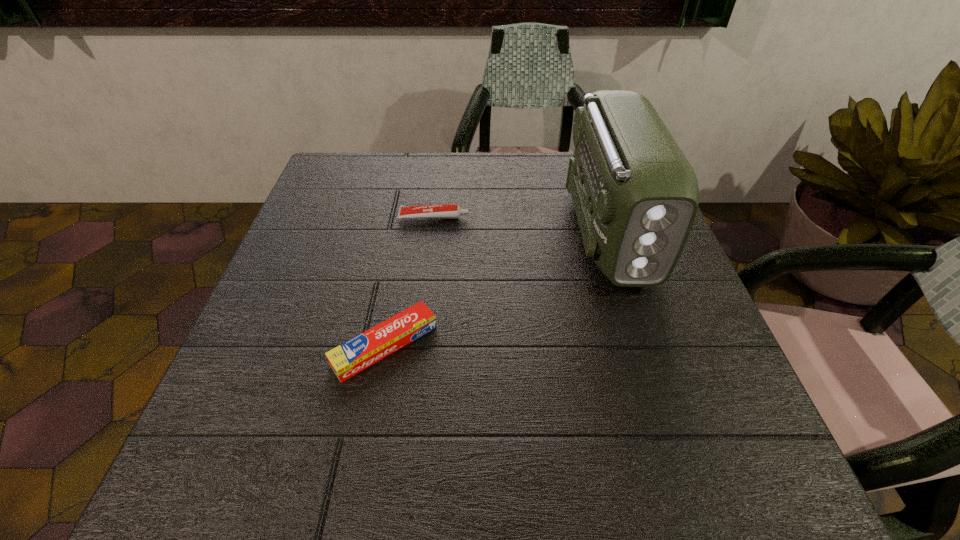
What are the coordinates of `free space between the farther toothpaste and the nearest object` in the screenshot? It's located at 410,281.

The height and width of the screenshot is (540, 960). In order to click on vacant region between the radio_receiver and the farther toothpaste in this screenshot , I will do `click(521, 224)`.

Image resolution: width=960 pixels, height=540 pixels. In order to click on free space between the nearest object and the rightmost object in this screenshot , I will do `click(497, 287)`.

Where is `free point between the radio_receiver and the nearest object`? free point between the radio_receiver and the nearest object is located at coordinates (497, 287).

Image resolution: width=960 pixels, height=540 pixels. I want to click on free area in between the radio_receiver and the farther toothpaste, so click(521, 224).

Identify the location of free point between the farther toothpaste and the radio_receiver. The image size is (960, 540). (521, 224).

At what (x,y) coordinates should I click in order to perform the action: click on object identified as the second closest to the farther toothpaste. Please return your answer as a coordinate pair (x, y). Looking at the image, I should click on click(x=353, y=356).

This screenshot has width=960, height=540. What are the coordinates of `object identified as the closest to the rightmost object` in the screenshot? It's located at (445, 211).

You are a GUI agent. You are given a task and a screenshot of the screen. Output one action in this format:
    pyautogui.click(x=<x>, y=<y>)
    Task: Click on the free spot that satisfies the following two spatial constraints: 1. at the nozzle of the farther toothpaste; 2. on the front side of the nearer toothpaste
    Image resolution: width=960 pixels, height=540 pixels.
    Given the screenshot: What is the action you would take?
    pyautogui.click(x=419, y=346)